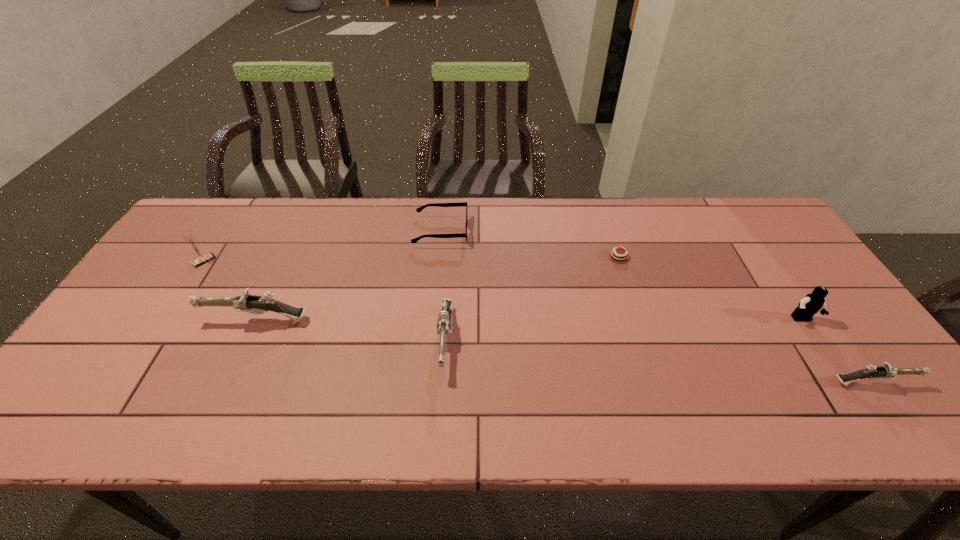
Where is `free space that is in between the rightmost gun and the shortest object`? This screenshot has width=960, height=540. free space that is in between the rightmost gun and the shortest object is located at coordinates (745, 320).

The width and height of the screenshot is (960, 540). Find the location of `free space that is in between the rightmost gun and the Lego`. free space that is in between the rightmost gun and the Lego is located at coordinates (837, 352).

At what (x,y) coordinates should I click in order to perform the action: click on free space between the second shortest object and the shortest object. Please return your answer as a coordinate pair (x, y). The width and height of the screenshot is (960, 540). Looking at the image, I should click on (530, 244).

Find the location of a particular element. vacant space in between the leftmost gun and the second tallest gun is located at coordinates (351, 330).

This screenshot has height=540, width=960. What are the coordinates of `vacant space that is in between the second gun from right to left and the matchbox` in the screenshot? It's located at (324, 300).

The image size is (960, 540). Identify the location of vacant point located between the Lego and the sixth object from right to left. (529, 320).

Identify the location of free spot between the shortest object and the leftmost object. This screenshot has width=960, height=540. (412, 259).

The height and width of the screenshot is (540, 960). I want to click on free space between the sixth object from right to left and the sixth tallest object, so point(348,276).

You are a GUI agent. You are given a task and a screenshot of the screen. Output one action in this format:
    pyautogui.click(x=<x>, y=<y>)
    Task: Click on the free space between the spectacles and the chocolate cake
    
    Given the screenshot: What is the action you would take?
    pyautogui.click(x=530, y=244)

You are a GUI agent. You are given a task and a screenshot of the screen. Output one action in this format:
    pyautogui.click(x=<x>, y=<y>)
    Task: Click on the empty space between the fifth object from left to right and the matchbox
    The width and height of the screenshot is (960, 540).
    Given the screenshot: What is the action you would take?
    pyautogui.click(x=412, y=259)